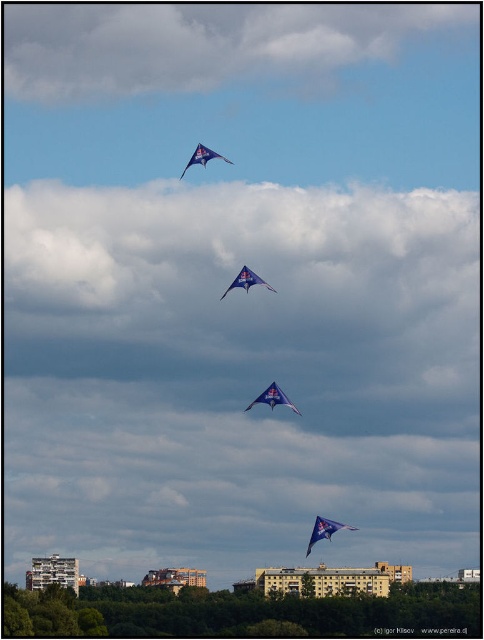
Question: Can you confirm if white fluffy cloud at upper center is thinner than blue fabric kite at lower center?

Choices:
 (A) yes
 (B) no

Answer: (B)

Question: Is white fluffy cloud at upper center above blue fabric kite at upper center?

Choices:
 (A) no
 (B) yes

Answer: (B)

Question: Estimate the real-world distances between objects in this image. Which object is closer to the white fluffy cloud at upper center?

Choices:
 (A) blue fabric kite at upper center
 (B) blue glossy kite at center

Answer: (A)

Question: Which object appears closest to the camera in this image?

Choices:
 (A) blue fabric kite at upper center
 (B) blue fabric kite at lower center
 (C) blue fabric kite at center
 (D) blue glossy kite at center

Answer: (D)

Question: Can you confirm if white fluffy cloud at upper center is positioned to the right of blue fabric kite at upper center?

Choices:
 (A) yes
 (B) no

Answer: (A)

Question: Which is farther from the blue fabric kite at upper center?

Choices:
 (A) blue fabric kite at center
 (B) blue glossy kite at center

Answer: (A)